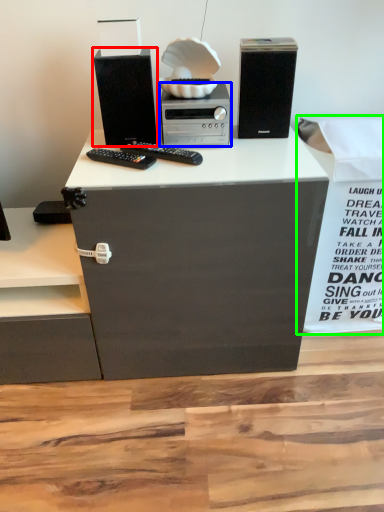
Question: Considering the real-world distances, which object is closest to computer tower (highlighted by a red box)? home appliance (highlighted by a blue box) or cardboard box (highlighted by a green box).

Choices:
 (A) home appliance
 (B) cardboard box

Answer: (A)